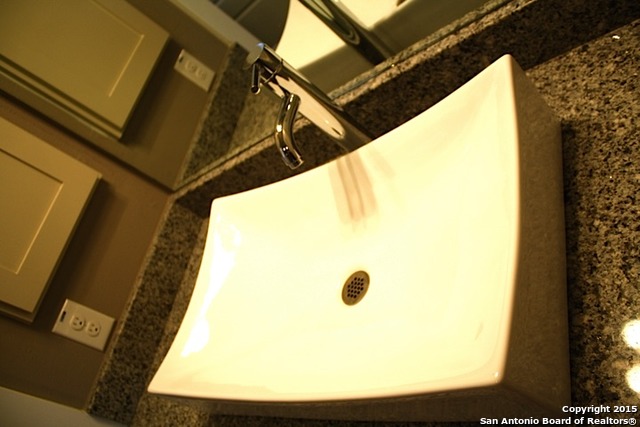
At what (x,y) coordinates should I click in order to perform the action: click on sink. Please return your answer as a coordinate pair (x, y). The image size is (640, 427). Looking at the image, I should click on (476, 246), (248, 257).